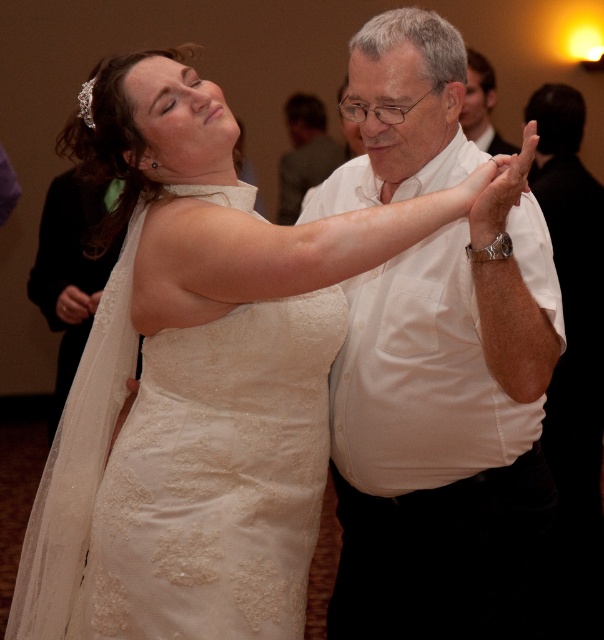
You are a photographer standing at the origin point of the image. You need to adjust your camera to focus on the white cotton shirt at center. What are the coordinates where you should aim your camera?

The white cotton shirt at center is located at coordinates point [448,428], so you should aim your camera at those coordinates to focus on it.

You are standing at the point with coordinates point (480,93) and want to move to the point with coordinates point (439,388). Is there an unobstructed path between these two points?

Point (439,388) is in front of point (480,93), so there is an unobstructed path between them.

You are standing in the middle of the dance floor and see two points marked on the floor. The first point is at coordinates point (486, 403) and the second is at point (312, 128). Which point is closer to you?

Point (486, 403) is in front of point (312, 128), so it is closer to you.